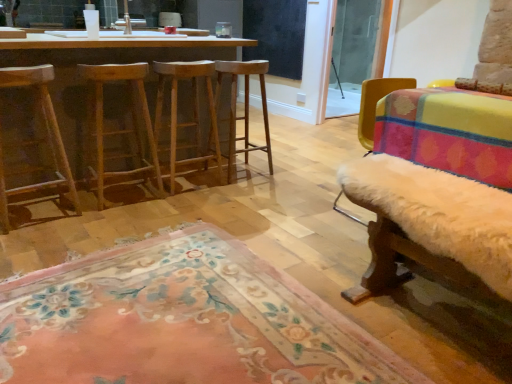
The image size is (512, 384). I want to click on free space in front of light brown wood stool at center, the second stool positioned from the left, so click(x=191, y=201).